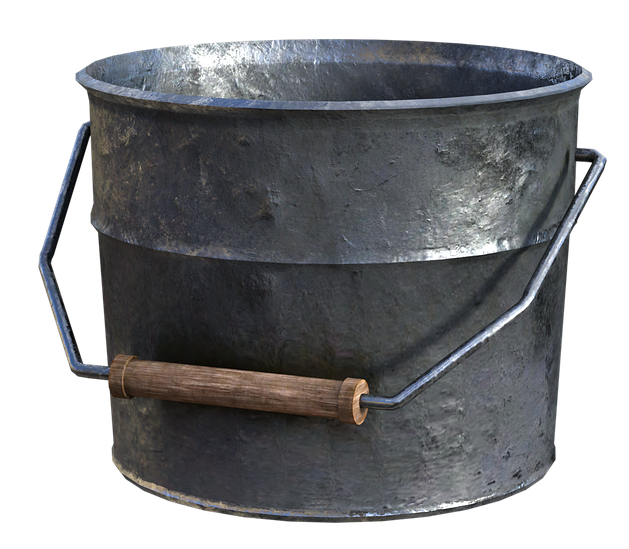
The height and width of the screenshot is (549, 629). Find the location of `wooden handle`. wooden handle is located at coordinates (214, 385).